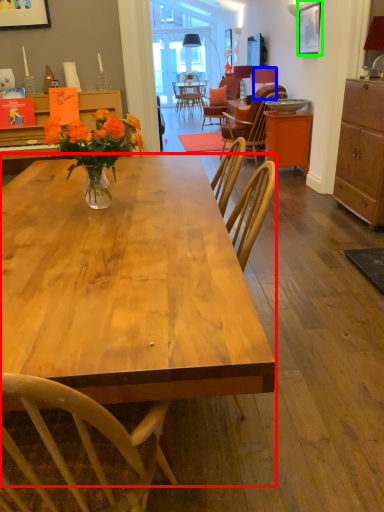
Question: Considering the real-world distances, which object is farthest from desk (highlighted by a red box)? lamp (highlighted by a blue box) or picture frame (highlighted by a green box)?

Choices:
 (A) lamp
 (B) picture frame

Answer: (A)